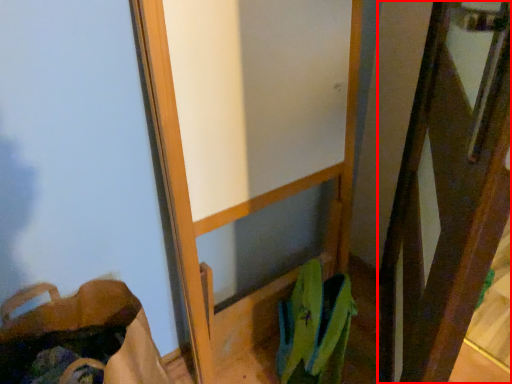
Question: Where is screen door (annotated by the red box) located in relation to shoulder bag in the image?

Choices:
 (A) left
 (B) right

Answer: (B)